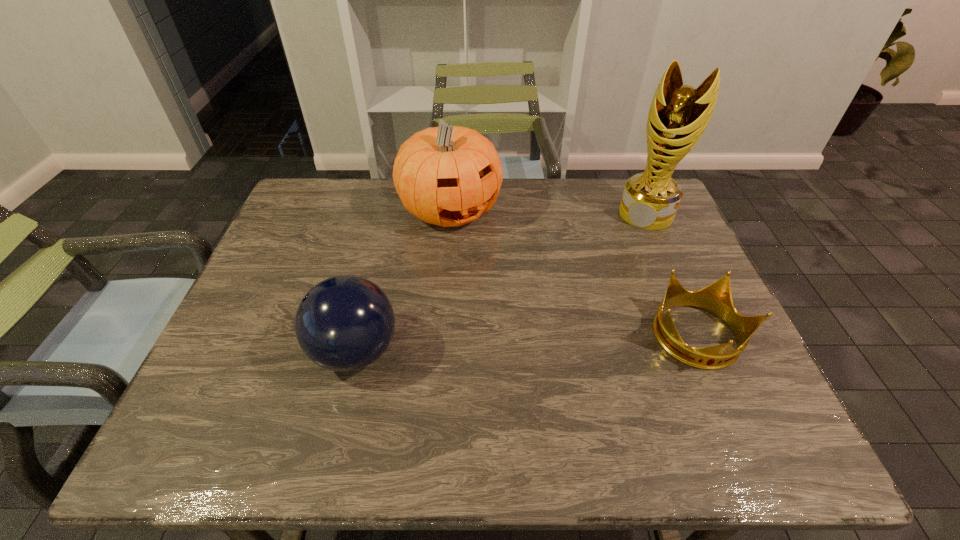
At what (x,y) coordinates should I click in order to perform the action: click on object present at the far right corner. Please return your answer as a coordinate pair (x, y). Image resolution: width=960 pixels, height=540 pixels. Looking at the image, I should click on (678, 115).

The image size is (960, 540). What are the coordinates of `object present at the near right corner` in the screenshot? It's located at (716, 298).

Find the location of a particular element. The width and height of the screenshot is (960, 540). vacant space at the far edge of the desktop is located at coordinates (560, 220).

In the image, there is a desktop. At what (x,y) coordinates should I click in order to perform the action: click on vacant space at the near edge. Please return your answer as a coordinate pair (x, y). This screenshot has width=960, height=540. Looking at the image, I should click on (362, 376).

Locate an element on the screen. Image resolution: width=960 pixels, height=540 pixels. free space at the left edge is located at coordinates (323, 244).

This screenshot has height=540, width=960. I want to click on vacant space at the right edge, so click(687, 342).

Find the location of a particular element. The height and width of the screenshot is (540, 960). vacant space at the far right corner of the desktop is located at coordinates (621, 194).

In the image, there is a desktop. Identify the location of free space at the near right corner. (752, 405).

The image size is (960, 540). Find the location of `vacant space that's between the third shortest object and the award`. vacant space that's between the third shortest object and the award is located at coordinates (548, 212).

Where is `free spot between the shortest object and the third tallest object`? free spot between the shortest object and the third tallest object is located at coordinates (526, 345).